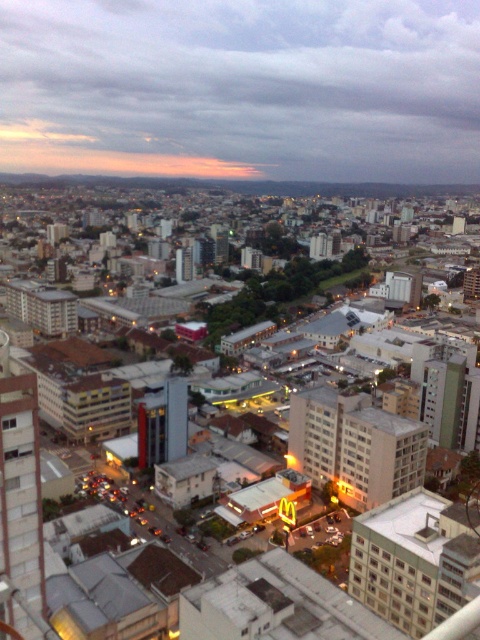
In the scene shown: You are a drone operator trying to navigate between the cloudy sky at upper center and the matte concrete buildings at center. Which direction should you fly to move from the cloudy sky to the buildings?

To move from the cloudy sky at upper center to the matte concrete buildings at center, you should fly to the right since the cloudy sky at upper center is located to the left of the matte concrete buildings at center.

From the picture: You are a drone operator trying to capture a photo of the cloudy sky at upper center and the matte concrete buildings at center from above. Based on their sizes in the image, which one would appear smaller in the photo?

The cloudy sky at upper center appears smaller in the photo compared to the matte concrete buildings at center because the cloudy sky at upper center has a smaller size compared to matte concrete buildings at center.

Looking at this image, you are a drone operator trying to capture a photo of the cloudy sky at upper center and the matte concrete buildings at center. Based on their sizes in the image, which one would appear larger in the photo?

The cloudy sky at upper center appears larger in the photo because its width is larger than the matte concrete buildings at center.